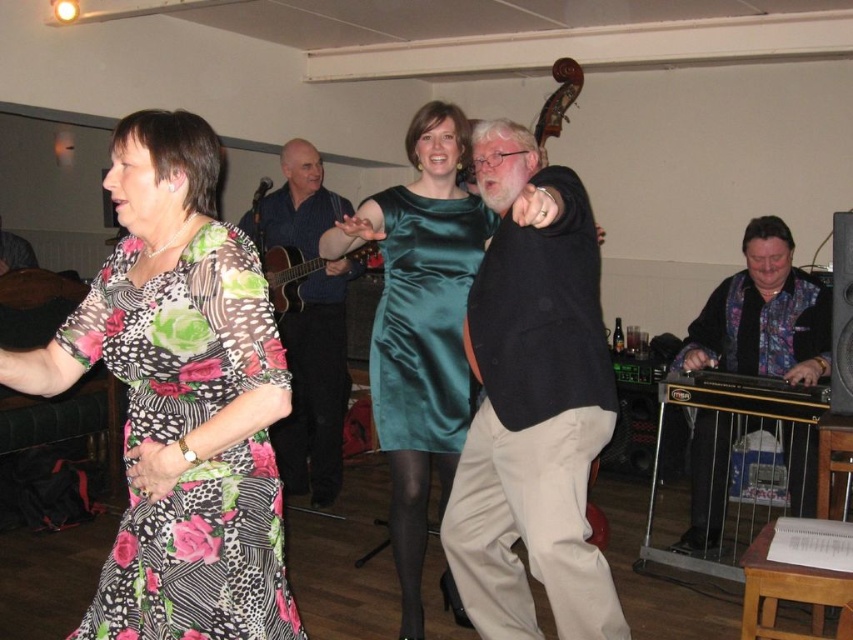
Question: Does blue shirt at center have a smaller size compared to matte brown guitar at center?

Choices:
 (A) yes
 (B) no

Answer: (B)

Question: Among these points, which one is farthest from the camera?

Choices:
 (A) (476, 246)
 (B) (337, 490)
 (C) (550, 548)
 (D) (781, 328)

Answer: (B)

Question: Does floral-patterned dress at center appear on the left side of dark gray sweater at center?

Choices:
 (A) no
 (B) yes

Answer: (B)

Question: Which point is closer to the camera?

Choices:
 (A) pyautogui.click(x=218, y=502)
 (B) pyautogui.click(x=305, y=292)

Answer: (A)

Question: Can you confirm if blue shirt at center is thinner than matte brown guitar at center?

Choices:
 (A) yes
 (B) no

Answer: (B)

Question: Which of the following is the farthest from the observer?

Choices:
 (A) (184, 387)
 (B) (350, 256)
 (C) (665, 387)
 (D) (212, 467)

Answer: (B)